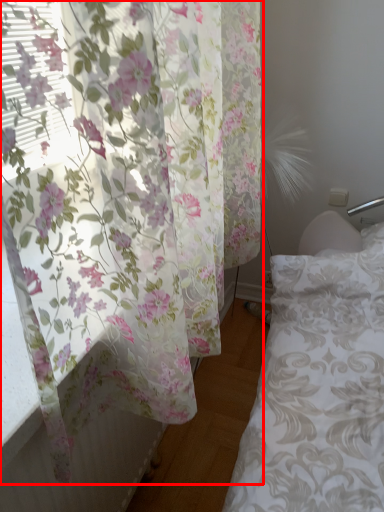
Question: Where is curtain (annotated by the red box) located in relation to bed frame in the image?

Choices:
 (A) left
 (B) right

Answer: (A)